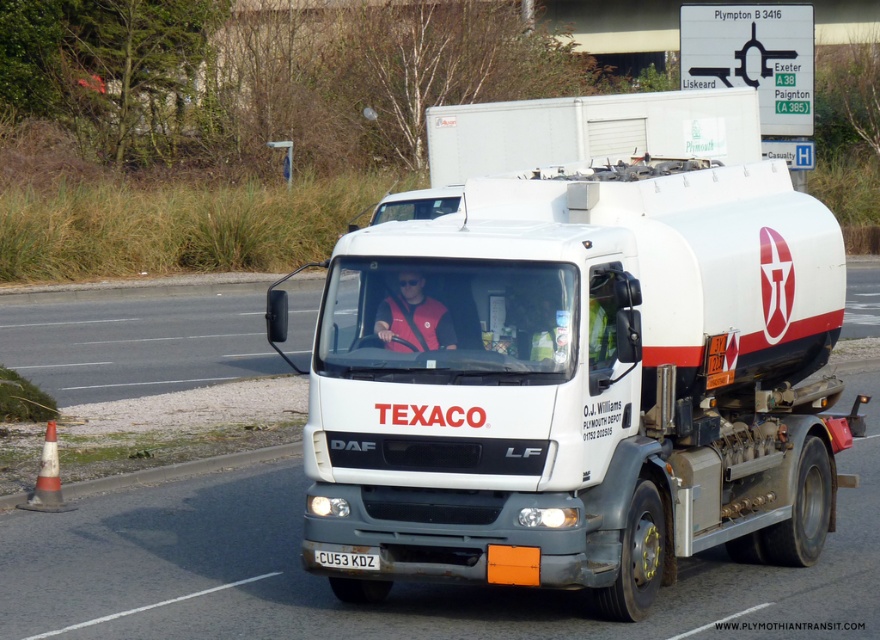
Where is `white matte tanker truck at center`? white matte tanker truck at center is located at coordinates (583, 385).

Is point (624, 188) positioned after point (341, 564)?

Yes, it is behind point (341, 564).

The width and height of the screenshot is (880, 640). Identify the location of white matte tanker truck at center. (583, 385).

Is point (398, 323) positioned before point (326, 550)?

Yes, point (398, 323) is in front of point (326, 550).

Measure the distance from red fabric vest at center to white plastic license plate at center.

A distance of 1.14 meters exists between red fabric vest at center and white plastic license plate at center.

Is point (397, 275) less distant than point (336, 564)?

No, (397, 275) is further to viewer.

At what (x,y) coordinates should I click in order to perform the action: click on red fabric vest at center. Please return your answer as a coordinate pair (x, y). This screenshot has width=880, height=640. Looking at the image, I should click on (413, 317).

Can you confirm if white matte tanker truck at center is positioned above red fabric vest at center?

Actually, white matte tanker truck at center is below red fabric vest at center.

Does white matte tanker truck at center have a lesser height compared to red fabric vest at center?

No, white matte tanker truck at center is not shorter than red fabric vest at center.

Who is more forward, [636,275] or [394,300]?

Point [394,300] is in front.

Identify the location of white matte tanker truck at center. This screenshot has width=880, height=640. (583, 385).